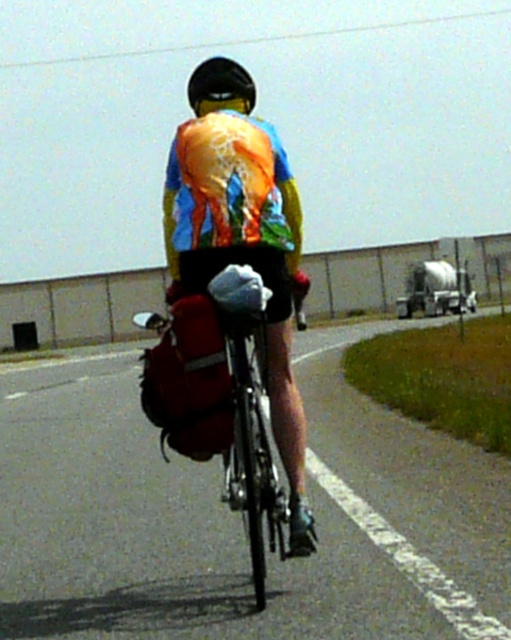
You are a cyclist who needs to check if your gear is properly secured. You have a matte red backpack at center and a shiny reflective safety vest at center. Which item takes up more space on your bike?

The matte red backpack at center is larger in size than the shiny reflective safety vest at center, so it takes up more space on the bike.